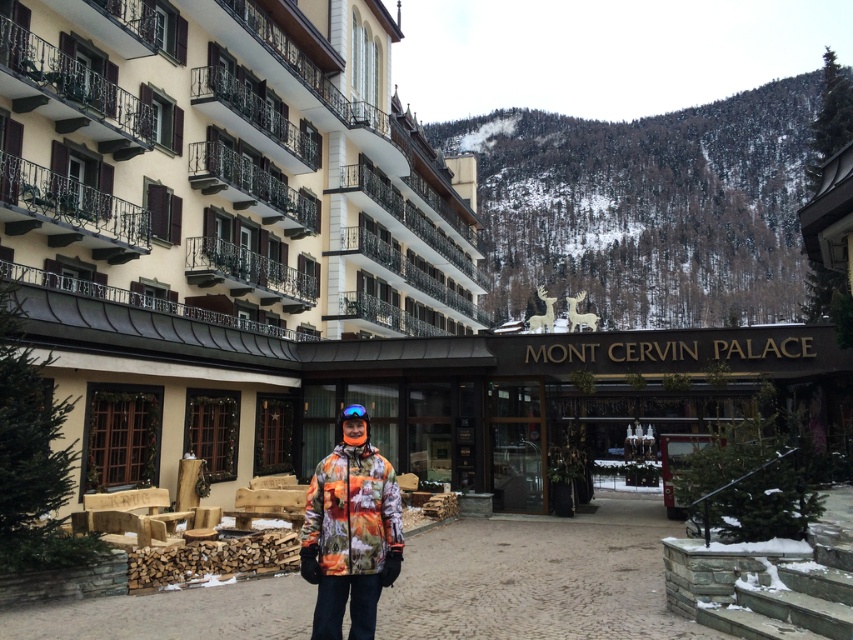
Question: Is floral-patterned jacket at center behind matte blue ski goggles at center?

Choices:
 (A) yes
 (B) no

Answer: (B)

Question: Which point is closer to the camera taking this photo?

Choices:
 (A) (375, 572)
 (B) (354, 413)
 (C) (469, 243)

Answer: (A)

Question: Is beige stone building at center above floral-patterned jacket at center?

Choices:
 (A) yes
 (B) no

Answer: (A)

Question: Does beige stone building at center appear over floral-patterned jacket at center?

Choices:
 (A) no
 (B) yes

Answer: (B)

Question: Among these objects, which one is nearest to the camera?

Choices:
 (A) matte blue ski goggles at center
 (B) beige stone building at center

Answer: (A)

Question: Which object appears farthest from the camera in this image?

Choices:
 (A) matte blue ski goggles at center
 (B) floral-patterned jacket at center

Answer: (A)